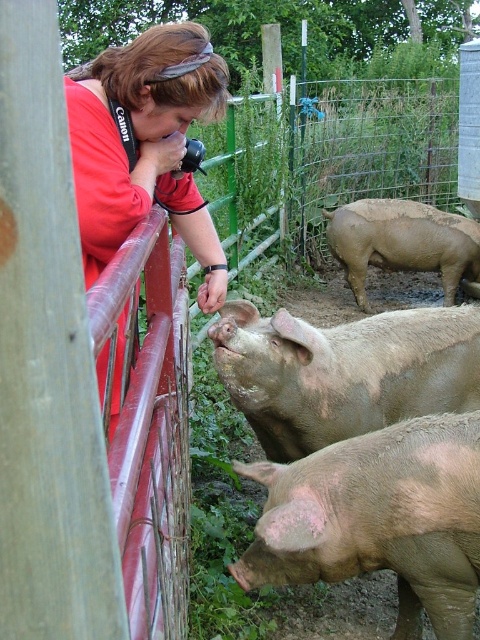
Is light brown muddy pig at center wider than matte red shirt at upper left?

Yes, light brown muddy pig at center is wider than matte red shirt at upper left.

Is point (367, 397) positioned in front of point (218, 244)?

No, it is not.

Identify the location of light brown muddy pig at center. (344, 371).

Which is in front, point (280, 342) or point (425, 236)?

Point (280, 342) is more forward.

Who is lower down, light brown muddy pig at center or brown muddy pig at center?

Positioned lower is light brown muddy pig at center.

Does point (254, 424) come closer to viewer compared to point (357, 289)?

Yes, point (254, 424) is closer to viewer.

Image resolution: width=480 pixels, height=640 pixels. Find the location of `light brown muddy pig at center`. light brown muddy pig at center is located at coordinates (344, 371).

Is brown matte pig at lower right positioned before light brown muddy pig at center?

Yes.

Which is above, brown matte pig at lower right or light brown muddy pig at center?

light brown muddy pig at center is above.

What do you see at coordinates (379, 518) in the screenshot? I see `brown matte pig at lower right` at bounding box center [379, 518].

Find the location of a particular element. The image size is (480, 640). brown matte pig at lower right is located at coordinates (379, 518).